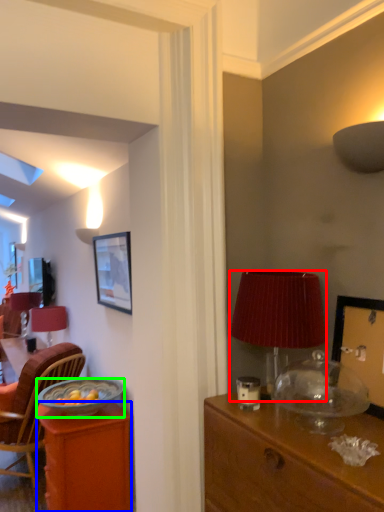
Question: Which object is the closest to the lamp (highlighted by a red box)? Choose among these: desk (highlighted by a blue box) or bowl (highlighted by a green box).

Choices:
 (A) desk
 (B) bowl

Answer: (B)